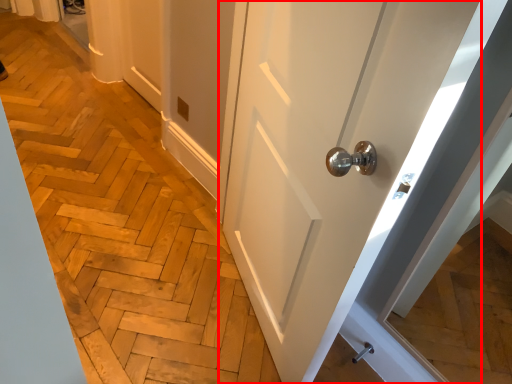
Question: Observing the image, what is the correct spatial positioning of door (annotated by the red box) in reference to door handle?

Choices:
 (A) right
 (B) left

Answer: (B)